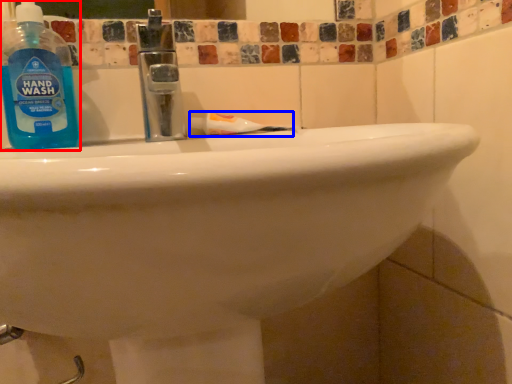
Question: Which object appears farthest to the camera in this image, cleaning product (highlighted by a red box) or toothpaste (highlighted by a blue box)?

Choices:
 (A) cleaning product
 (B) toothpaste

Answer: (B)